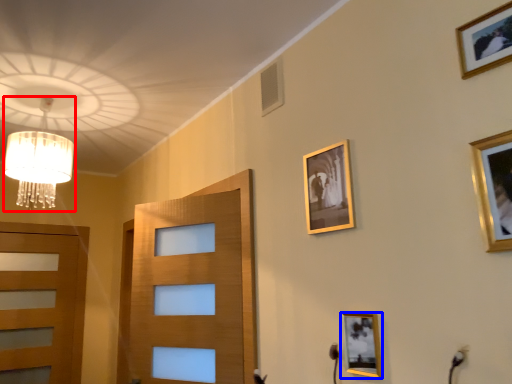
Question: Which object is further to the camera taking this photo, lamp (highlighted by a red box) or picture frame (highlighted by a blue box)?

Choices:
 (A) lamp
 (B) picture frame

Answer: (A)